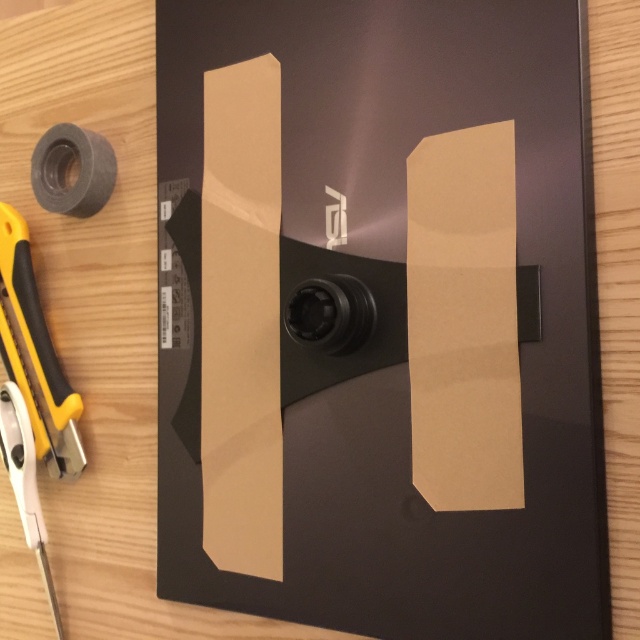
Consider the image. You are a photographer setting up a closeup shot of the brown matte cardboard at center. The camera is positioned at a distance where the cardboard is in focus. If you want to include the black ASUS monitor in the frame without moving the camera, will the monitor be in focus?

The brown matte cardboard at center is 26.04 inches away from the camera. Since the black ASUS monitor is closer to the camera than the cardboard, it would likely be in focus as well if it falls within the depth of field. However, if the depth of field is very narrow, only the cardboard might be in focus while the monitor appears blurry.

You are organizing a desk and need to place the brown matte cardboard at center and the gray matte tape at upper left. According to the scene, which object is positioned to the right of the other?

The brown matte cardboard at center is to the right of the gray matte tape at upper left.